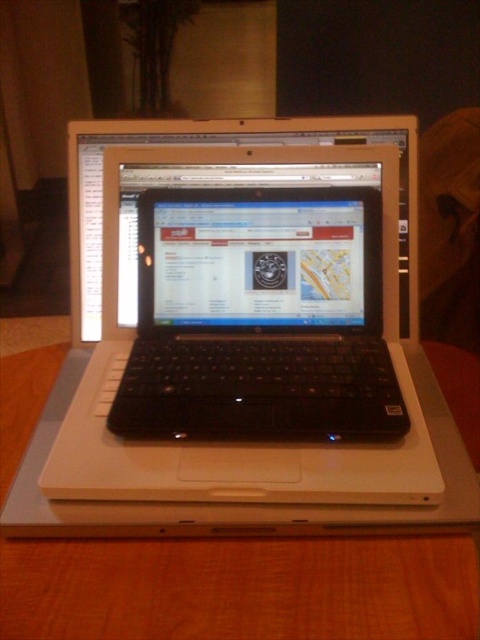
Is black matte laptop at center taller than wooden table at center?

Yes, black matte laptop at center is taller than wooden table at center.

Between point (261, 467) and point (58, 632), which one is positioned in front?

Positioned in front is point (58, 632).

The height and width of the screenshot is (640, 480). Identify the location of black matte laptop at center. (248, 333).